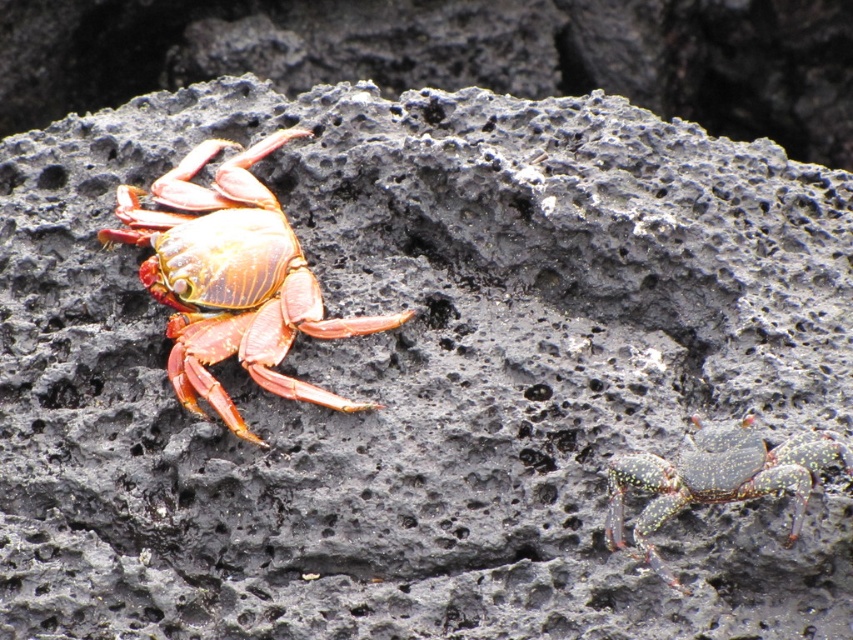
You are a marine biologist observing two crabs on a volcanic rock. You notice the shiny orange crab at left and the shiny metallic crab at lower right. Which crab has a greater height?

The shiny orange crab at left is taller than the shiny metallic crab at lower right.

You are standing at the origin point of the coordinate system. You want to move to the shiny orange crab at left. What are the coordinates you need to move to?

The coordinates you need to move to are 0.438 in the x direction and 0.272 in the y direction.